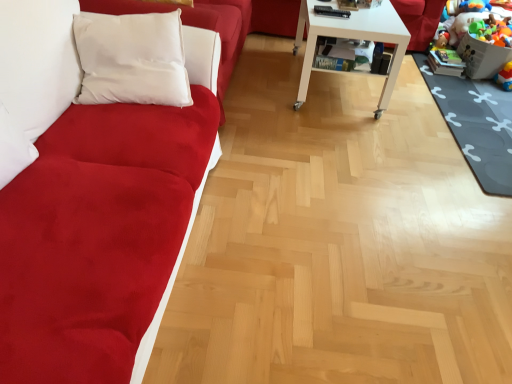
This screenshot has height=384, width=512. I want to click on vacant space to the left of rubberized plastic toy at lower right, which appears as the first toy when ordered from the bottom, so click(486, 84).